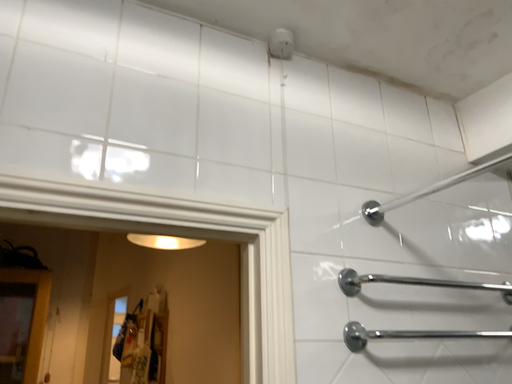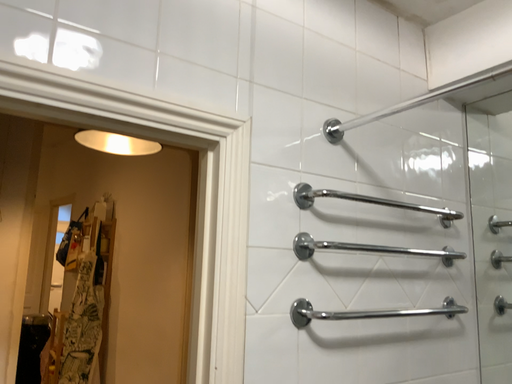
Question: How did the camera likely rotate when shooting the video?

Choices:
 (A) rotated downward
 (B) rotated upward

Answer: (A)